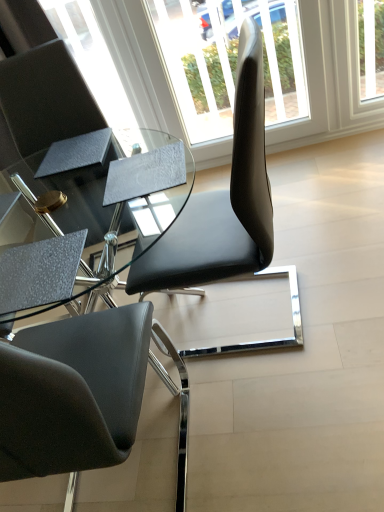
Question: Is matte black chair at upper left completely or partially outside of transparent glass window at center?

Choices:
 (A) yes
 (B) no

Answer: (A)

Question: Does matte black chair at upper left lie behind transparent glass window at center?

Choices:
 (A) yes
 (B) no

Answer: (B)

Question: Is matte black chair at upper left turned away from transparent glass window at center?

Choices:
 (A) yes
 (B) no

Answer: (B)

Question: Is matte black chair at upper left facing towards transparent glass window at center?

Choices:
 (A) no
 (B) yes

Answer: (A)

Question: Is matte black chair at upper left thinner than transparent glass window at center?

Choices:
 (A) no
 (B) yes

Answer: (A)

Question: Can you confirm if matte black chair at upper left is shorter than transparent glass window at center?

Choices:
 (A) no
 (B) yes

Answer: (B)

Question: Is transparent glass window at center to the right of matte black chair at upper left from the viewer's perspective?

Choices:
 (A) yes
 (B) no

Answer: (A)

Question: From the image's perspective, is transparent glass window at center over matte black chair at upper left?

Choices:
 (A) no
 (B) yes

Answer: (B)

Question: Can you confirm if transparent glass window at center is bigger than matte black chair at upper left?

Choices:
 (A) no
 (B) yes

Answer: (A)

Question: Is transparent glass window at center with matte black chair at upper left?

Choices:
 (A) yes
 (B) no

Answer: (B)

Question: Is transparent glass window at center facing away from matte black chair at upper left?

Choices:
 (A) no
 (B) yes

Answer: (A)

Question: Would you say matte black chair at upper left is part of transparent glass window at center's contents?

Choices:
 (A) no
 (B) yes

Answer: (A)

Question: Is point (228, 57) positioned closer to the camera than point (41, 181)?

Choices:
 (A) closer
 (B) farther

Answer: (B)